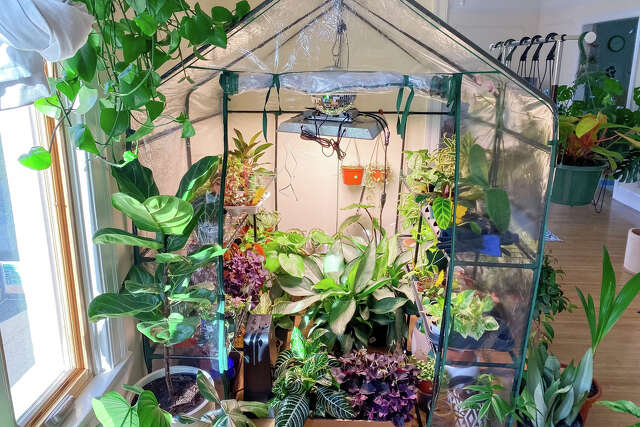
In order to click on wooden floor in this screenshot , I will do `click(584, 234)`, `click(611, 348)`, `click(576, 338)`.